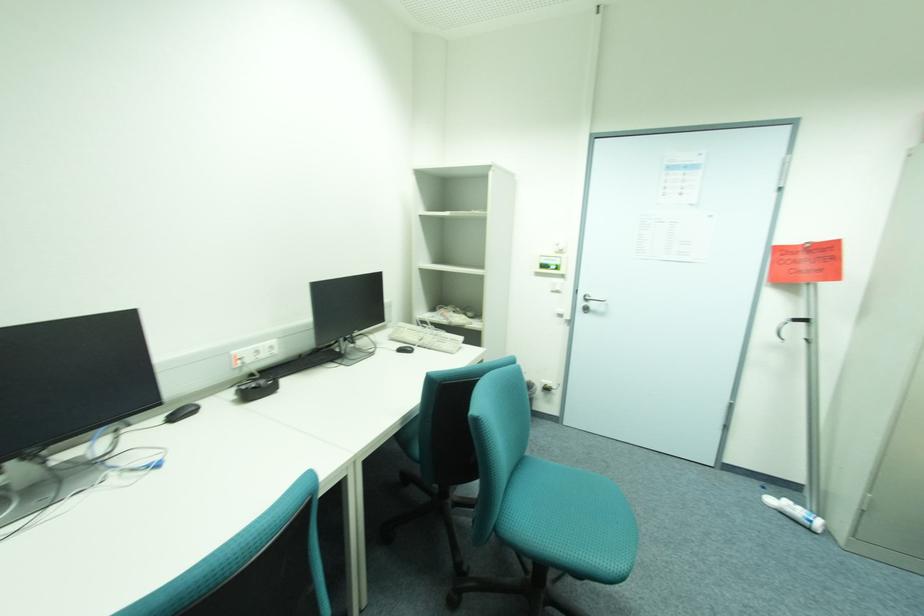
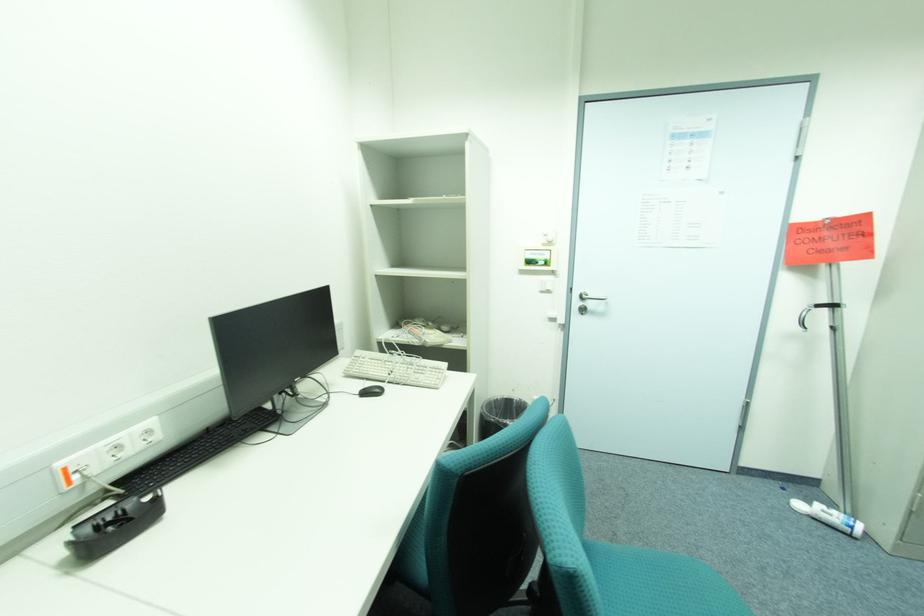
Question: The images are taken continuously from a first-person perspective. In which direction is your viewpoint rotating?

Choices:
 (A) Left
 (B) Right
 (C) Up
 (D) Down

Answer: (B)